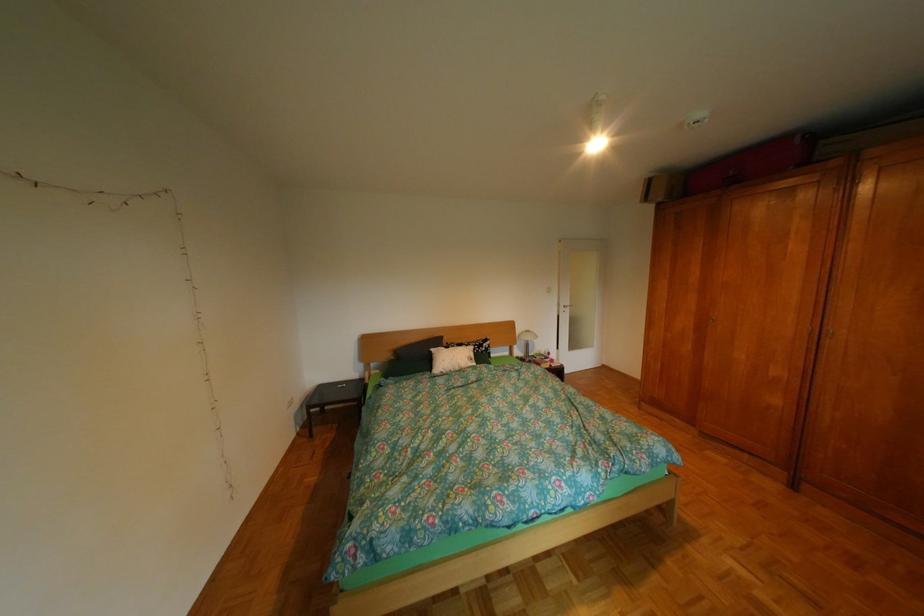
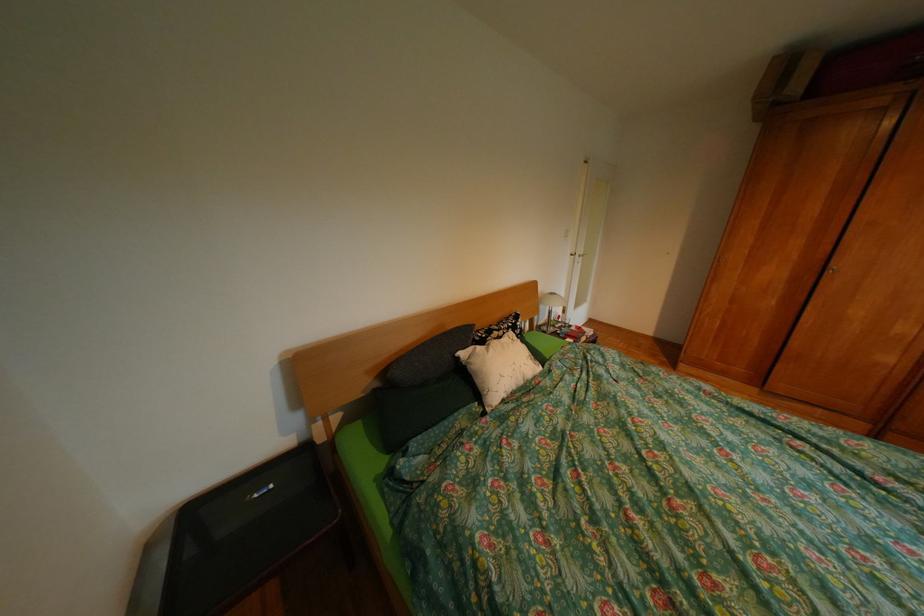
In the second image, find the point that corresponds to the point at 447,350 in the first image.

(477, 354)